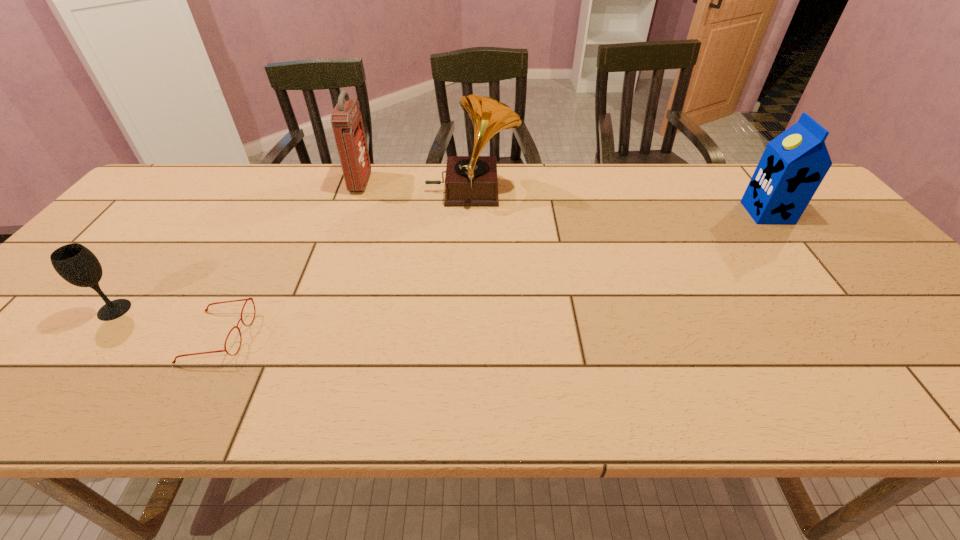
I want to click on free region located 0.110m with the cap open on the rightmost object, so click(709, 213).

Where is `vacant space located 0.190m with the cap open on the rightmost object`? vacant space located 0.190m with the cap open on the rightmost object is located at coordinates (682, 213).

Locate an element on the screen. vacant region located on the back of the leftmost object is located at coordinates (146, 269).

Identify the location of blank space located on the face of the shortest object. This screenshot has height=540, width=960. (399, 336).

The width and height of the screenshot is (960, 540). In order to click on phonograph record present at the far edge in this screenshot , I will do `click(472, 180)`.

This screenshot has width=960, height=540. I want to click on the first-aid kit at the far edge, so 346,119.

Identify the location of carton that is positioned at the far edge. (793, 165).

Where is `object situated at the left edge`? The image size is (960, 540). object situated at the left edge is located at coordinates (75, 263).

This screenshot has height=540, width=960. Identify the location of object located at the right edge. (793, 165).

Where is `object that is at the far right corner`? This screenshot has height=540, width=960. object that is at the far right corner is located at coordinates (793, 165).